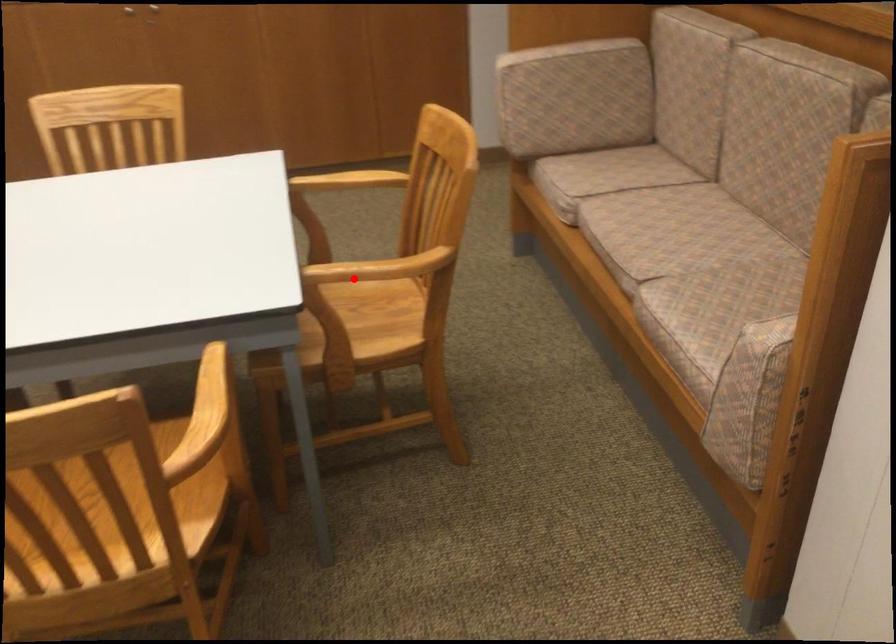
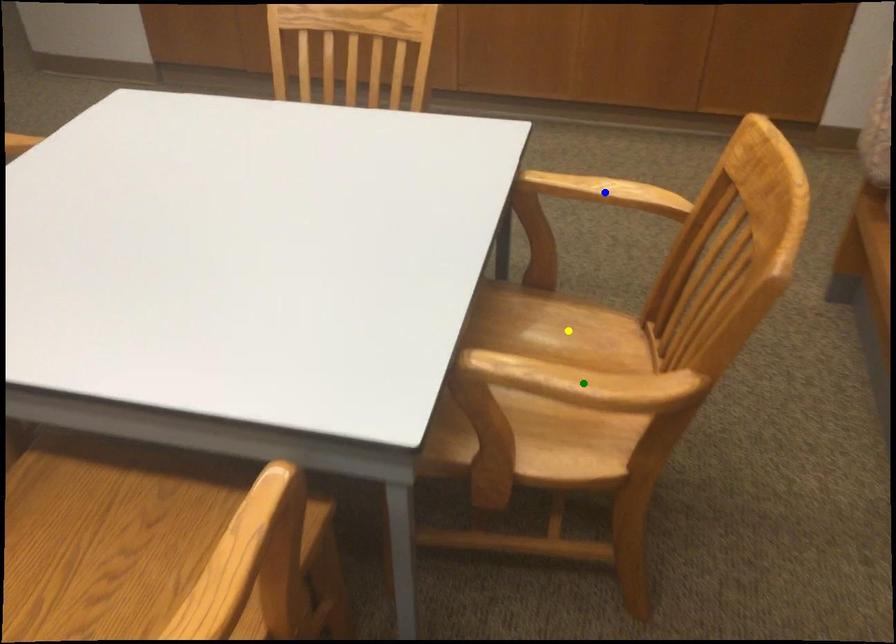
Question: I am providing you with two images of the same scene from different viewpoints. A red point is marked on the first image. You are given multiple points on the second image. Can you choose the point in image 2 that corresponds to the point in image 1?

Choices:
 (A) green point
 (B) blue point
 (C) yellow point

Answer: (C)